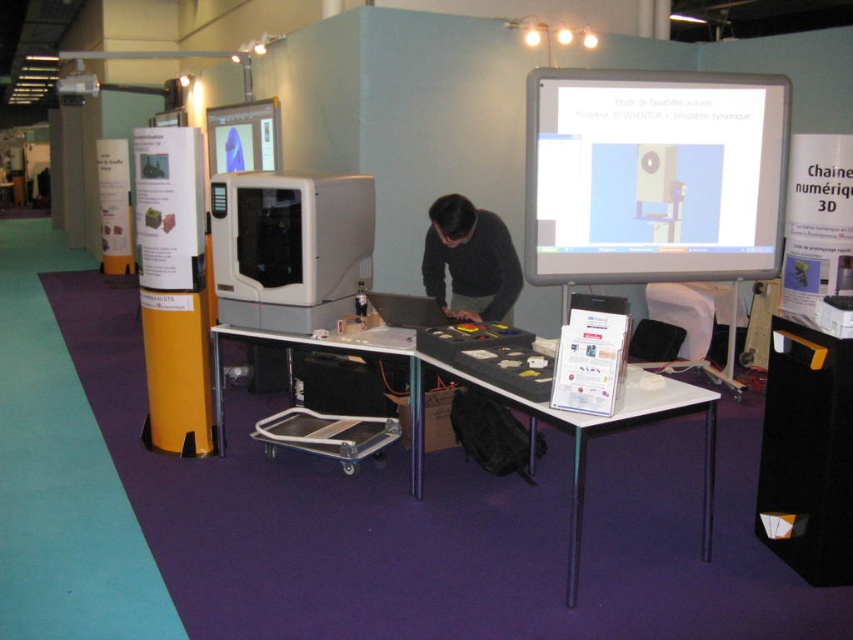
You are at the center of the booth and want to pick up the dark gray sweater at center. In which direction should you move to reach it?

The dark gray sweater at center is located at coordinates point (x=469, y=260), so you should move towards the center of the booth to reach it.

You are setting up a booth and need to place a dark gray sweater at center on the white plastic table at center. Will the sweater fit on the table?

The white plastic table at center has a larger width than the dark gray sweater at center, so the sweater will fit on the table.

You are a visitor at the exhibition and want to place a 15 cm tall model on the white plastic table at center without it touching the dark gray sweater at center. Is this possible?

The white plastic table at center is taller than the dark gray sweater at center, so placing a 15 cm tall model on the table would not cause it to touch the sweater since the table is higher.